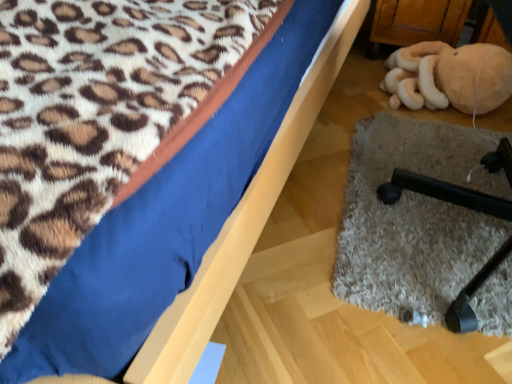
This screenshot has width=512, height=384. I want to click on free point below black rubber chair leg at lower right (from a real-world perspective), so click(419, 220).